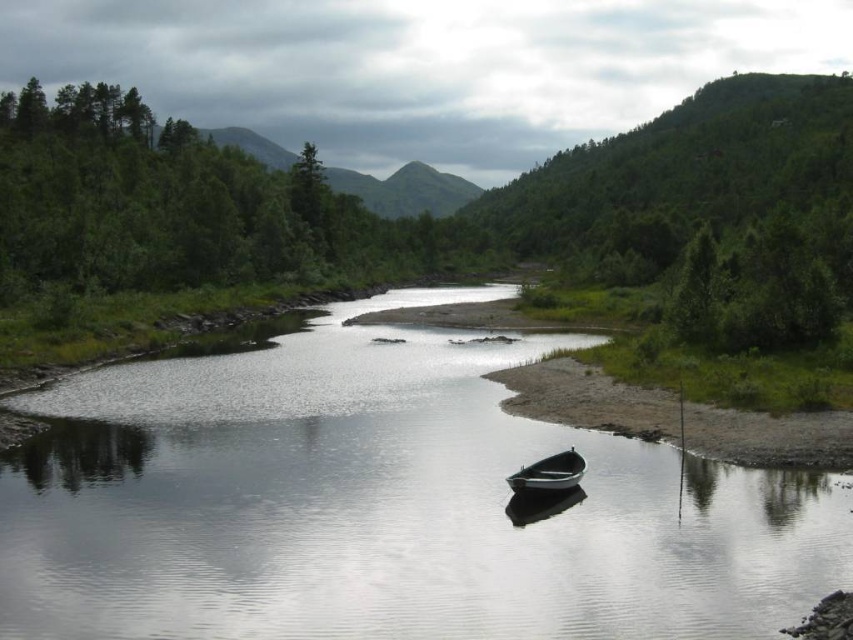
Question: Which point is closer to the camera?

Choices:
 (A) clear water at center
 (B) metallic gray boat at center

Answer: (A)

Question: Among these points, which one is nearest to the camera?

Choices:
 (A) (554, 472)
 (B) (756, 84)
 (C) (550, 371)
 (D) (337, 310)

Answer: (A)

Question: Where is green leafy tree at center located in relation to metallic gray boat at center in the image?

Choices:
 (A) above
 (B) below

Answer: (A)

Question: Does green grassy shore at lower right have a larger size compared to metallic gray boat at center?

Choices:
 (A) no
 (B) yes

Answer: (B)

Question: Is green grassy shore at lower right positioned in front of metallic gray boat at center?

Choices:
 (A) no
 (B) yes

Answer: (A)

Question: Which object is farther from the camera taking this photo?

Choices:
 (A) metallic gray boat at center
 (B) green grassy shore at lower right
 (C) green leafy tree at center
 (D) clear water at center

Answer: (C)